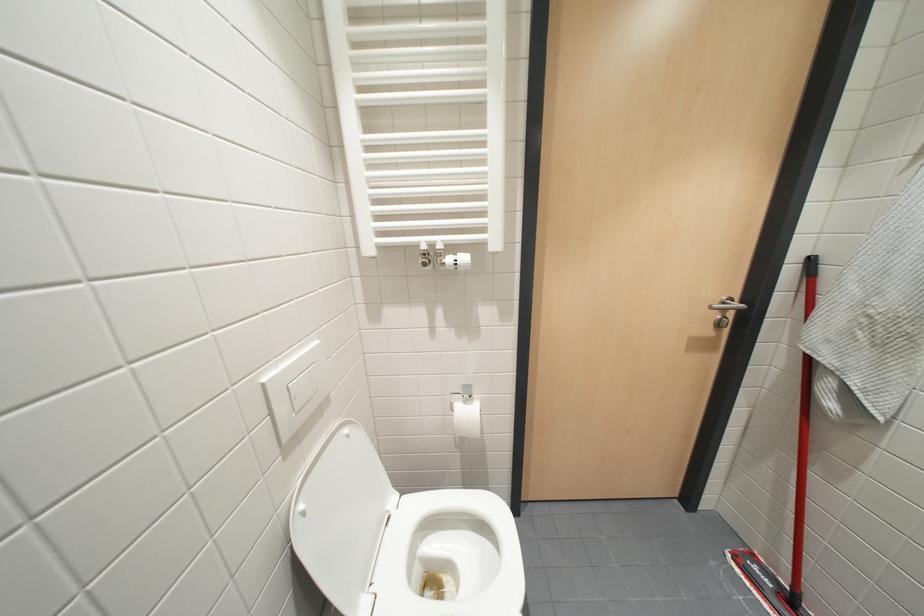
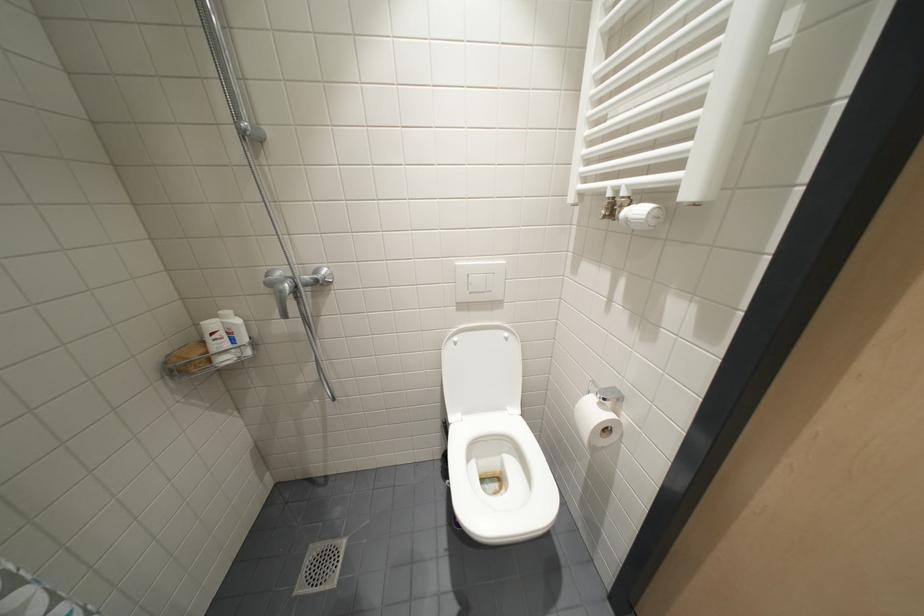
First-person continuous shooting, in which direction is the camera rotating?

The camera rotated toward left-down.